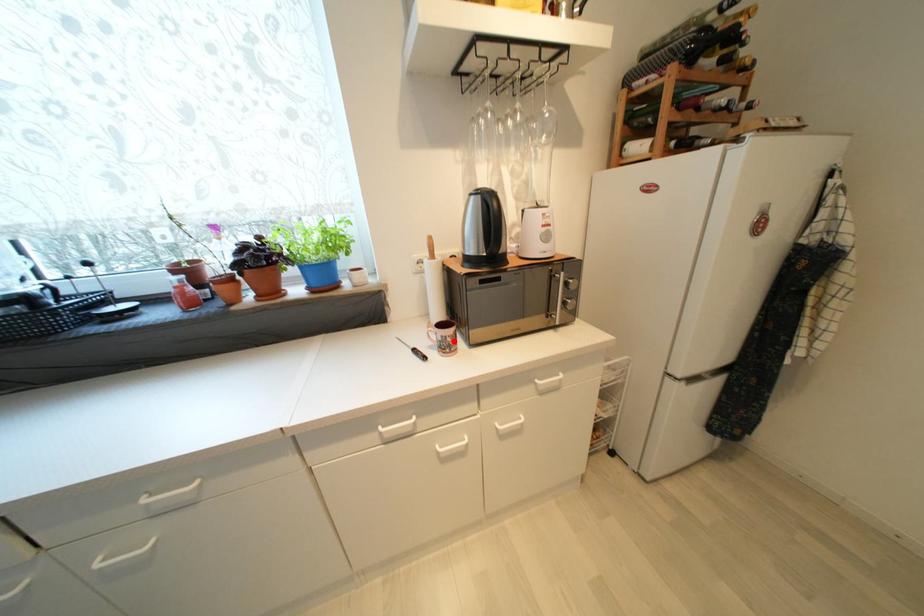
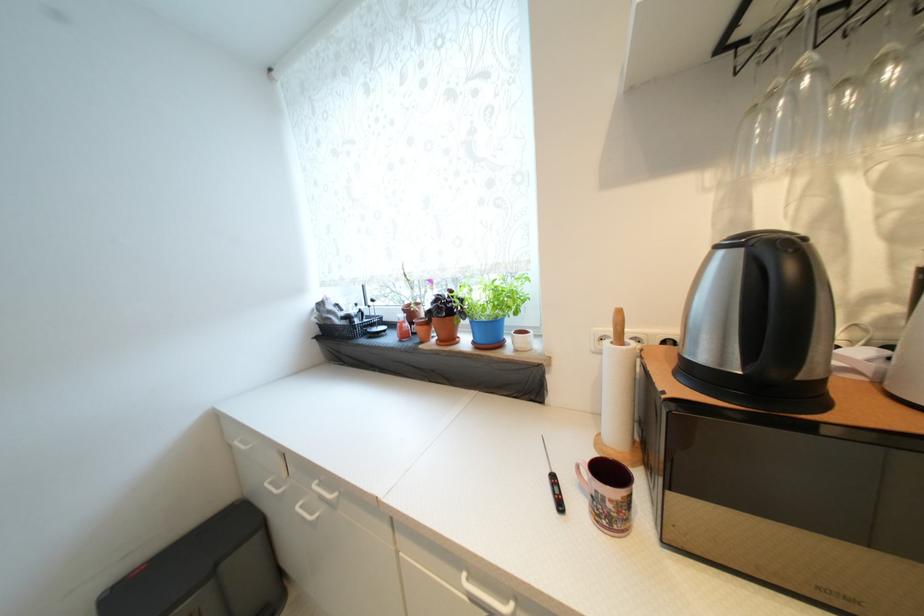
Find the pixel in the second image that matches the highlighted location in the first image.

(614, 508)